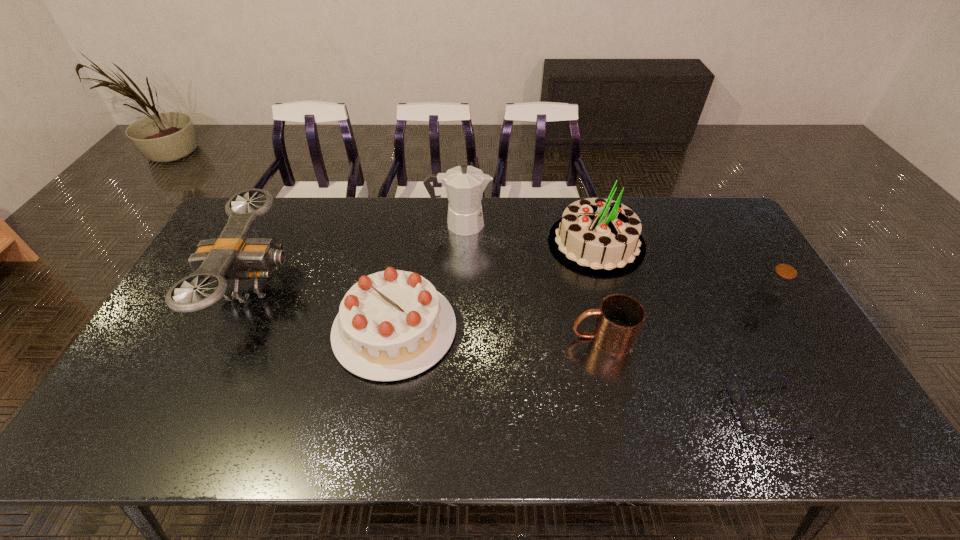
Where is `vacant area at the far edge of the desktop`? The image size is (960, 540). vacant area at the far edge of the desktop is located at coordinates (307, 198).

Where is `vacant space at the near edge`? vacant space at the near edge is located at coordinates (372, 414).

Where is `vacant space at the far left corner of the desktop`? This screenshot has height=540, width=960. vacant space at the far left corner of the desktop is located at coordinates (252, 228).

Locate an element on the screen. The height and width of the screenshot is (540, 960). vacant space at the far right corner is located at coordinates (695, 233).

You are a GUI agent. You are given a task and a screenshot of the screen. Output one action in this format:
    pyautogui.click(x=<x>, y=<y>)
    Task: Click on the vacant space that is in between the drone and the farther birthday cake
    This screenshot has width=960, height=540.
    Given the screenshot: What is the action you would take?
    pyautogui.click(x=425, y=264)

Locate an element on the screen. This screenshot has width=960, height=540. empty space between the shorter birthday cake and the rightmost object is located at coordinates [x=581, y=314].

You are a GUI agent. You are given a task and a screenshot of the screen. Output one action in this format:
    pyautogui.click(x=<x>, y=<y>)
    Task: Click on the vacant space that's between the drone and the fourth shortest object
    
    Given the screenshot: What is the action you would take?
    pyautogui.click(x=324, y=307)

Find the location of a particular element. vacant point located between the shortest object and the nearer birthday cake is located at coordinates (582, 369).

The image size is (960, 540). In order to click on blank region between the jar and the fourth tallest object in this screenshot , I will do `click(581, 314)`.

The width and height of the screenshot is (960, 540). What are the coordinates of `vacant point located between the leftmost object and the farther birthday cake` in the screenshot? It's located at (425, 264).